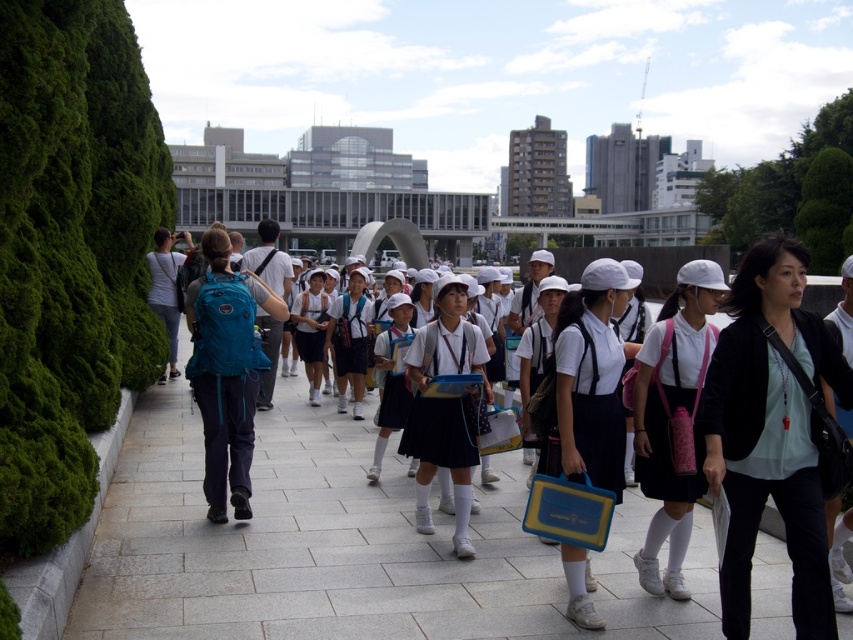
Between point (155, 560) and point (704, 388), which one is positioned behind?

Point (155, 560)

Between point (706, 596) and point (799, 400), which one is positioned in front?

Point (799, 400)

Between point (283, 381) and point (813, 385), which one is positioned behind?

The point (283, 381) is behind.

The image size is (853, 640). I want to click on gray concrete pavement at center, so click(x=345, y=547).

Image resolution: width=853 pixels, height=640 pixels. Describe the element at coordinates (345, 547) in the screenshot. I see `gray concrete pavement at center` at that location.

Which is in front, point (788, 586) or point (117, 204)?

Point (788, 586)

Is point (328, 515) farther from camera compared to point (100, 19)?

That is False.

Find the location of a particular element. This screenshot has height=640, width=853. gray concrete pavement at center is located at coordinates (345, 547).

Is green leafy hedge at left above teal fabric backpack at center-left?

Yes, green leafy hedge at left is above teal fabric backpack at center-left.

Does green leafy hedge at left appear on the left side of teal fabric backpack at center-left?

Indeed, green leafy hedge at left is positioned on the left side of teal fabric backpack at center-left.

Where is `green leafy hedge at left`? green leafy hedge at left is located at coordinates (70, 252).

I want to click on green leafy hedge at left, so click(x=70, y=252).